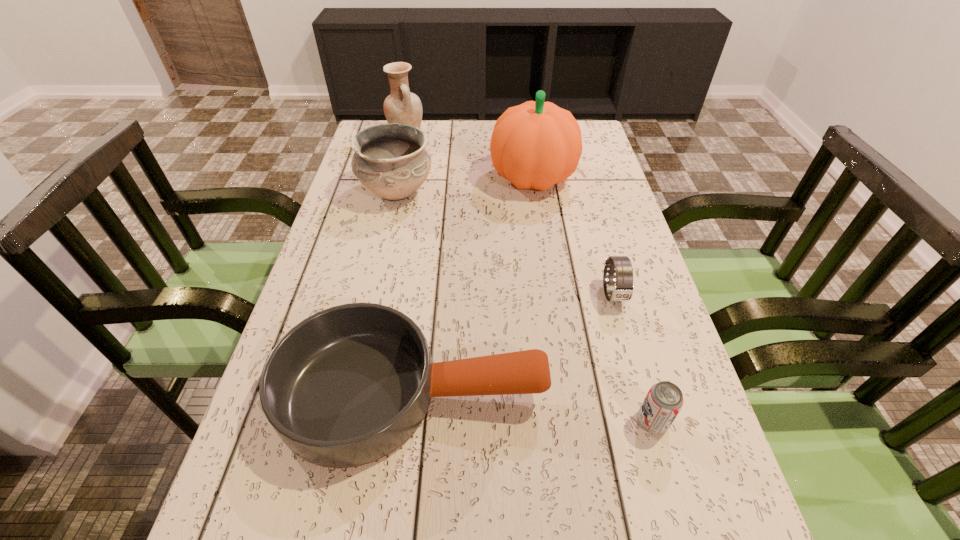
Locate an element on the screen. This screenshot has width=960, height=540. vacant space situated 0.240m on the back of the third tallest object is located at coordinates (410, 132).

Where is `free space located on the handle side of the pan`? The width and height of the screenshot is (960, 540). free space located on the handle side of the pan is located at coordinates click(594, 394).

The width and height of the screenshot is (960, 540). I want to click on vacant space located 0.180m on the face of the third nearest object, so click(638, 386).

I want to click on free region located on the left of the beer can, so click(559, 421).

Locate an element on the screen. The height and width of the screenshot is (540, 960). pumpkin that is at the far edge is located at coordinates (535, 145).

Where is `pottery at the far edge`? This screenshot has height=540, width=960. pottery at the far edge is located at coordinates (401, 106).

Image resolution: width=960 pixels, height=540 pixels. In order to click on pan that is at the left edge in this screenshot , I will do `click(347, 386)`.

Identify the location of pumpkin that is at the right edge. (535, 145).

This screenshot has width=960, height=540. Identify the location of watch positioned at the right edge. (621, 265).

Find the location of a particular element. Image resolution: width=960 pixels, height=540 pixels. beer can present at the right edge is located at coordinates (664, 400).